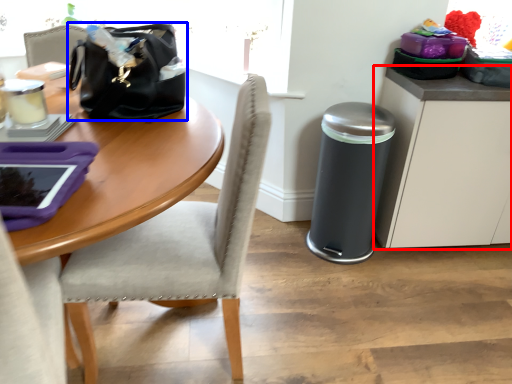
Question: Which object appears closest to the camera in this image, cabinetry (highlighted by a red box) or handbag (highlighted by a blue box)?

Choices:
 (A) cabinetry
 (B) handbag

Answer: (B)